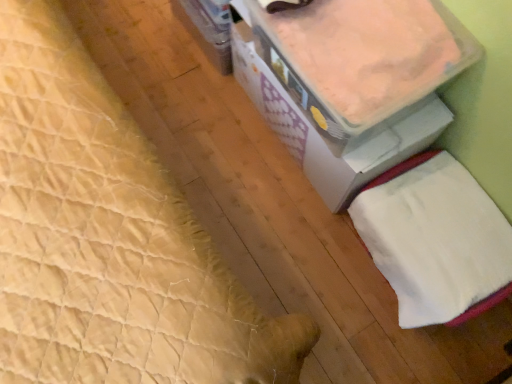
Where is `free space above white soft towel at lower right (from a real-world perspective)`? The height and width of the screenshot is (384, 512). free space above white soft towel at lower right (from a real-world perspective) is located at coordinates (451, 238).